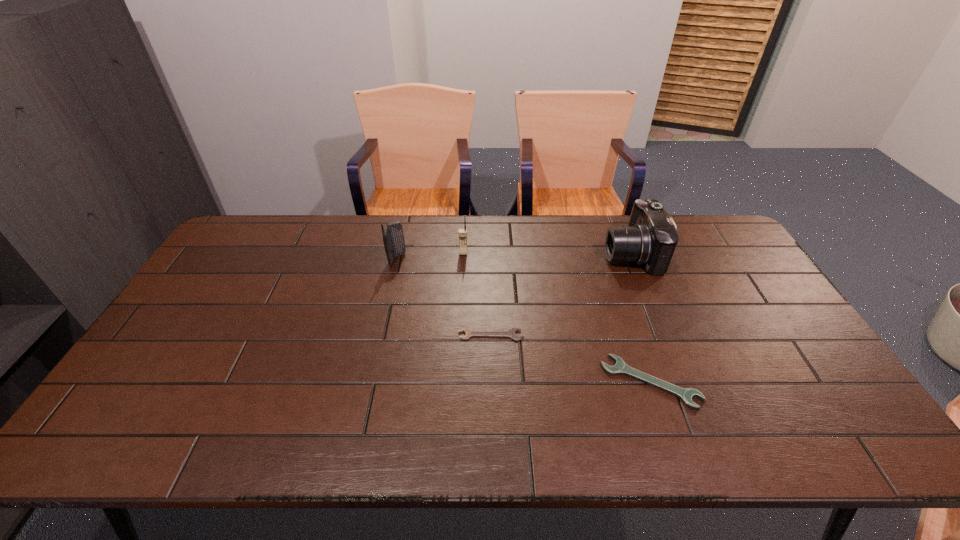
Locate an element on the screen. The width and height of the screenshot is (960, 540). object that is the second nearest to the second nearest object is located at coordinates (393, 238).

What are the coordinates of `free region that satisfies the following two spatial constraints: 1. on the keyboard of the leftmost object; 2. on the back side of the shorter wrench` in the screenshot? It's located at (380, 335).

At what (x,y) coordinates should I click in order to perform the action: click on free region that satisfies the following two spatial constraints: 1. on the front of the right cellular telephone, where the keypad is located; 2. on the left side of the left wrench. Please return your answer as a coordinate pair (x, y). Looking at the image, I should click on (460, 335).

The height and width of the screenshot is (540, 960). Identify the location of vacant position in the image that satisfies the following two spatial constraints: 1. on the keyboard of the leftmost object; 2. on the back side of the taller wrench. (371, 382).

This screenshot has height=540, width=960. I want to click on vacant position in the image that satisfies the following two spatial constraints: 1. on the keyboard of the right wrench; 2. on the left side of the leftmost object, so click(x=371, y=382).

Image resolution: width=960 pixels, height=540 pixels. What are the coordinates of `free point that satisfies the following two spatial constraints: 1. on the front of the right wrench, where the keypad is located; 2. on the right side of the right cellular telephone` in the screenshot? It's located at (458, 382).

This screenshot has width=960, height=540. In order to click on vacant space that satisfies the following two spatial constraints: 1. on the keyboard of the shorter wrench; 2. on the right side of the left cellular telephone in this screenshot , I will do `click(380, 335)`.

Where is `vacant space that satisfies the following two spatial constraints: 1. on the front of the nearest object, where the keypad is located; 2. on the left side of the right cellular telephone`? The image size is (960, 540). vacant space that satisfies the following two spatial constraints: 1. on the front of the nearest object, where the keypad is located; 2. on the left side of the right cellular telephone is located at coordinates (458, 382).

Where is `free location that satisfies the following two spatial constraints: 1. on the front of the right cellular telephone, where the keypad is located; 2. on the right side of the right wrench`? This screenshot has width=960, height=540. free location that satisfies the following two spatial constraints: 1. on the front of the right cellular telephone, where the keypad is located; 2. on the right side of the right wrench is located at coordinates (458, 382).

Find the location of `free space that satisfies the following two spatial constraints: 1. on the back side of the shorter wrench; 2. on the keyboard of the left cellular telephone`. free space that satisfies the following two spatial constraints: 1. on the back side of the shorter wrench; 2. on the keyboard of the left cellular telephone is located at coordinates (489, 259).